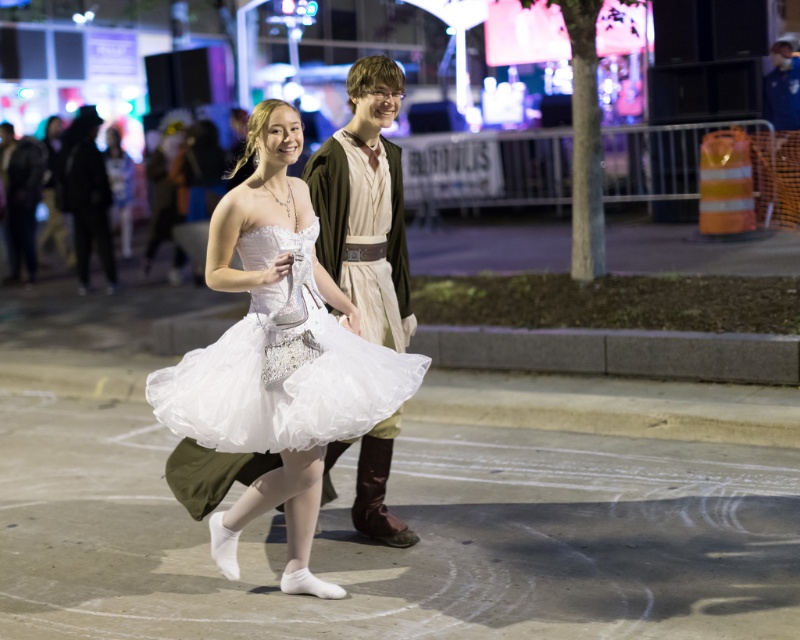
Question: Is white tulle skirt at center thinner than brown leather belt at center?

Choices:
 (A) yes
 (B) no

Answer: (B)

Question: Among these points, which one is nearest to the camera?

Choices:
 (A) (85, 292)
 (B) (362, 522)
 (C) (324, 372)
 (D) (252, 134)

Answer: (C)

Question: Estimate the real-world distances between objects in this image. Which object is farther from the matte white dress at center?

Choices:
 (A) white tulle dress at center
 (B) brown leather belt at center

Answer: (A)

Question: In this image, where is white tulle skirt at center located relative to brown leather belt at center?

Choices:
 (A) right
 (B) left

Answer: (B)

Question: Which object is the closest to the white tulle dress at center?

Choices:
 (A) white tulle skirt at center
 (B) matte white dress at center

Answer: (A)

Question: In this image, where is white tulle skirt at center located relative to brown leather belt at center?

Choices:
 (A) below
 (B) above

Answer: (A)